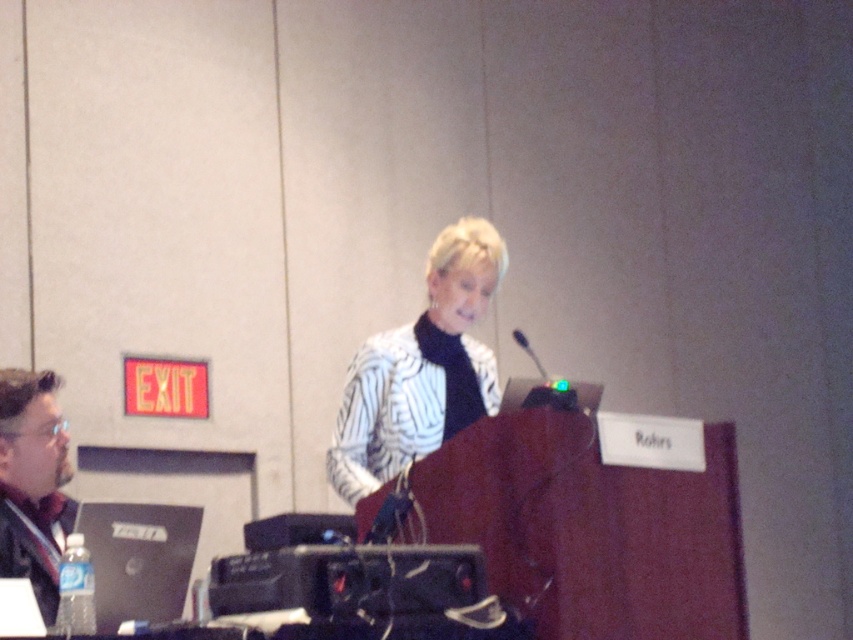
Question: Among these points, which one is farthest from the camera?

Choices:
 (A) (520, 330)
 (B) (16, 529)
 (C) (358, 412)

Answer: (A)

Question: Considering the real-world distances, which object is farthest from the matte black laptop at left?

Choices:
 (A) white textured blazer at center
 (B) black plastic microphone at center

Answer: (B)

Question: In this image, where is matte black laptop at left located relative to black plastic microphone at center?

Choices:
 (A) left
 (B) right

Answer: (A)

Question: Does white textured blazer at center appear on the right side of matte black laptop at left?

Choices:
 (A) no
 (B) yes

Answer: (B)

Question: Can you confirm if matte black laptop at left is thinner than black plastic microphone at center?

Choices:
 (A) yes
 (B) no

Answer: (B)

Question: Among these objects, which one is farthest from the camera?

Choices:
 (A) black plastic microphone at center
 (B) white textured blazer at center
 (C) matte black laptop at left

Answer: (A)